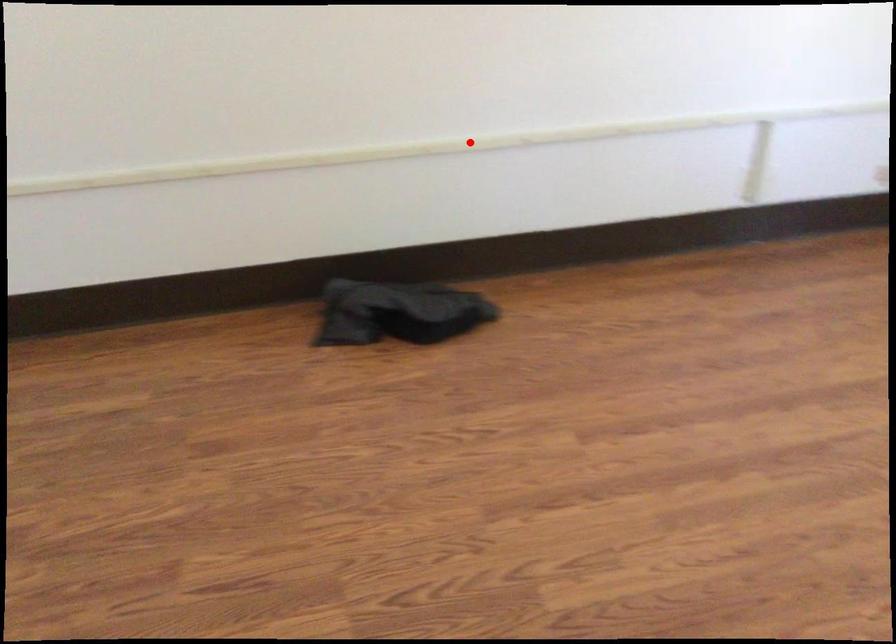
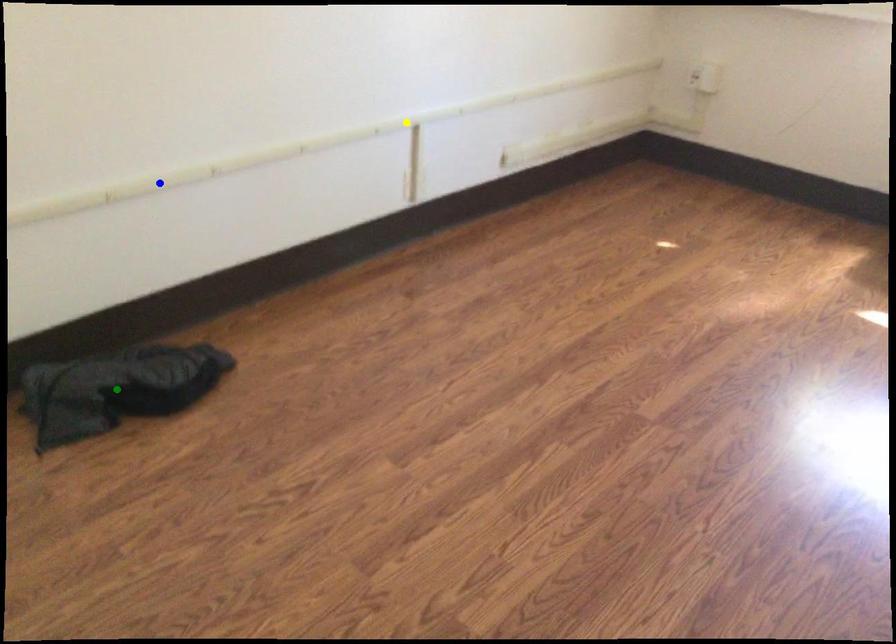
Question: I am providing you with two images of the same scene from different viewpoints. A red point is marked on the first image. You are given multiple points on the second image. Which point in image 2 represents the same 3d spot as the red point in image 1?

Choices:
 (A) yellow point
 (B) blue point
 (C) green point

Answer: (B)